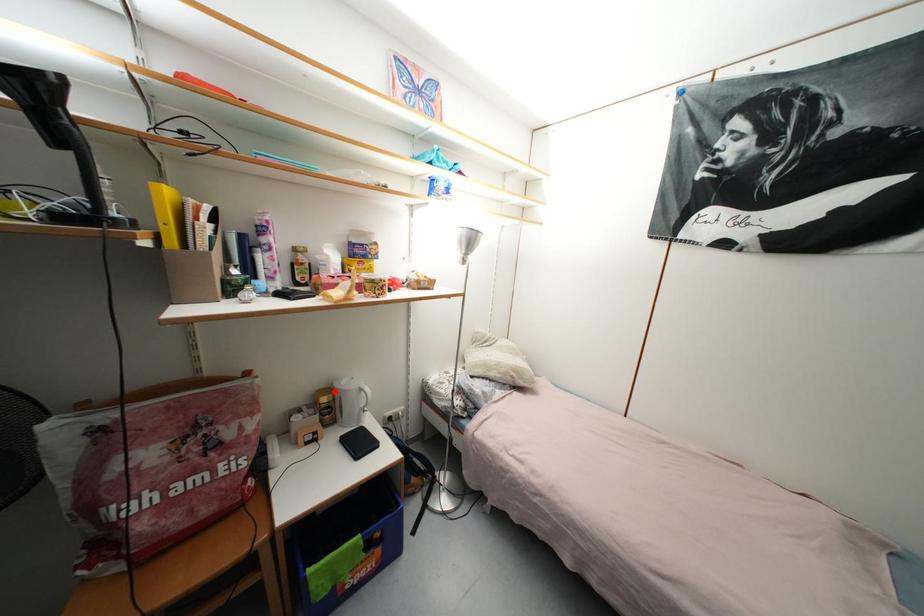
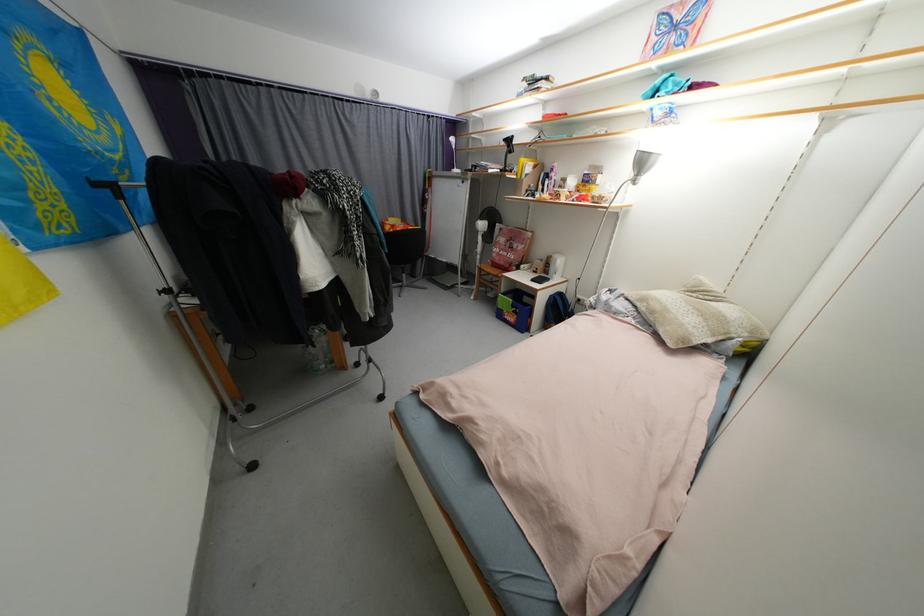
Question: A red point is marked in image1. In image2, is the corresponding 3D point closer to the camera or farther? Reply with the corresponding letter.

Choices:
 (A) The corresponding 3D point is closer.
 (B) The corresponding 3D point is farther.

Answer: (A)